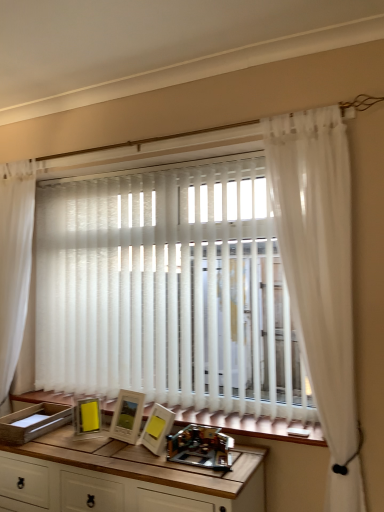
Question: Does white sheer curtain at left, which is counted as the 1th curtain, starting from the back, appear on the left side of wooden table at center?

Choices:
 (A) no
 (B) yes

Answer: (B)

Question: Can you confirm if white sheer curtain at left, the 1th curtain in the left-to-right sequence, is thinner than wooden table at center?

Choices:
 (A) yes
 (B) no

Answer: (A)

Question: Is white sheer curtain at left, which is counted as the 1th curtain, starting from the back, directly adjacent to wooden table at center?

Choices:
 (A) yes
 (B) no

Answer: (B)

Question: Would you say white sheer curtain at left, which is counted as the 1th curtain, starting from the back, contains wooden table at center?

Choices:
 (A) yes
 (B) no

Answer: (B)

Question: Considering the relative sizes of white sheer curtain at left, which ranks as the second curtain in front-to-back order, and wooden table at center in the image provided, is white sheer curtain at left, which ranks as the second curtain in front-to-back order, wider than wooden table at center?

Choices:
 (A) yes
 (B) no

Answer: (B)

Question: From a real-world perspective, is matte white picture frame at center, placed as the second picture frame when sorted from left to right, positioned above or below wooden table at center?

Choices:
 (A) above
 (B) below

Answer: (A)

Question: Looking at their shapes, would you say matte white picture frame at center, marked as the second picture frame in a right-to-left arrangement, is wider or thinner than wooden table at center?

Choices:
 (A) thin
 (B) wide

Answer: (A)

Question: Is point (134, 414) positioned closer to the camera than point (19, 486)?

Choices:
 (A) closer
 (B) farther

Answer: (B)

Question: Considering the positions of matte white picture frame at center, marked as the second picture frame in a right-to-left arrangement, and wooden table at center in the image, is matte white picture frame at center, marked as the second picture frame in a right-to-left arrangement, taller or shorter than wooden table at center?

Choices:
 (A) tall
 (B) short

Answer: (B)

Question: Choose the correct answer: Is matte wooden picture frame at center, the first picture frame from the right, inside metallic plastic toy at center or outside it?

Choices:
 (A) outside
 (B) inside

Answer: (A)

Question: From the image's perspective, is matte wooden picture frame at center, the first picture frame from the right, positioned above or below metallic plastic toy at center?

Choices:
 (A) above
 (B) below

Answer: (A)

Question: Would you say matte wooden picture frame at center, positioned as the 3th picture frame in left-to-right order, is to the left or to the right of metallic plastic toy at center in the picture?

Choices:
 (A) right
 (B) left

Answer: (B)

Question: From their relative heights in the image, would you say matte wooden picture frame at center, the first picture frame from the right, is taller or shorter than metallic plastic toy at center?

Choices:
 (A) short
 (B) tall

Answer: (B)

Question: In terms of height, does wooden table at center look taller or shorter compared to white sheer curtain at left, which is counted as the 1th curtain, starting from the back?

Choices:
 (A) short
 (B) tall

Answer: (A)

Question: Would you say wooden table at center is to the left or to the right of white sheer curtain at left, the 1th curtain in the left-to-right sequence, in the picture?

Choices:
 (A) left
 (B) right

Answer: (B)